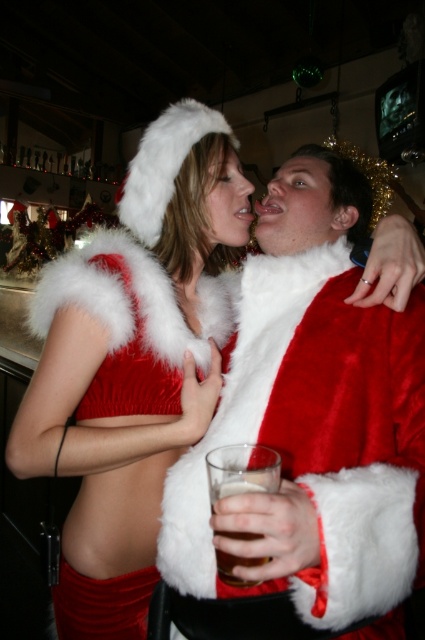
Question: Estimate the real-world distances between objects in this image. Which object is farther from the velvet red dress at center?

Choices:
 (A) brown translucent glass at center
 (B) velvet santa coat at center

Answer: (A)

Question: Can you confirm if velvet santa coat at center is thinner than brown translucent glass at center?

Choices:
 (A) no
 (B) yes

Answer: (A)

Question: Among these points, which one is farthest from the camera?

Choices:
 (A) (221, 592)
 (B) (163, 266)

Answer: (B)

Question: Can you confirm if velvet santa coat at center is bigger than velvet red dress at center?

Choices:
 (A) yes
 (B) no

Answer: (B)

Question: Among these objects, which one is farthest from the camera?

Choices:
 (A) velvet santa coat at center
 (B) brown translucent glass at center
 (C) velvet red dress at center

Answer: (C)

Question: Observing the image, what is the correct spatial positioning of velvet red dress at center in reference to brown translucent glass at center?

Choices:
 (A) left
 (B) right

Answer: (A)